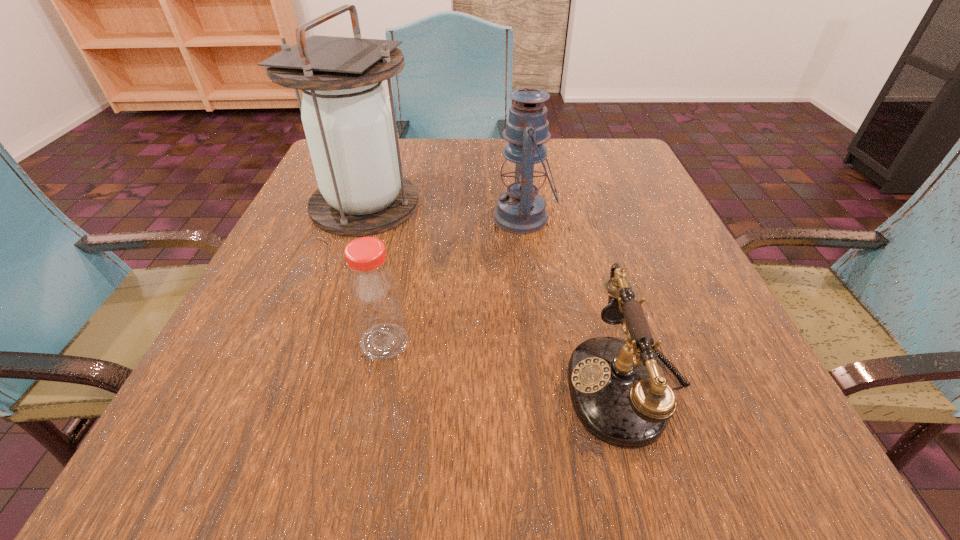
You are a GUI agent. You are given a task and a screenshot of the screen. Output one action in this format:
    pyautogui.click(x=<x>, y=<y>)
    Task: Click on the vacant space located on the front of the third tallest object
    Image resolution: width=960 pixels, height=540 pixels.
    Given the screenshot: What is the action you would take?
    pyautogui.click(x=372, y=407)

Find the location of `free region located on the dial of the shortest object`. free region located on the dial of the shortest object is located at coordinates (371, 383).

The height and width of the screenshot is (540, 960). In order to click on free location located on the dial of the shortest object in this screenshot , I will do `click(514, 383)`.

Where is `free space located on the dial of the shortest object`? free space located on the dial of the shortest object is located at coordinates (439, 383).

Locate an element on the screen. object located in the far edge section of the desktop is located at coordinates (350, 125).

Where is `object present at the near edge`? The height and width of the screenshot is (540, 960). object present at the near edge is located at coordinates (618, 394).

The height and width of the screenshot is (540, 960). Find the location of `object that is at the left edge`. object that is at the left edge is located at coordinates (350, 125).

Where is `object that is at the right edge`? The width and height of the screenshot is (960, 540). object that is at the right edge is located at coordinates (618, 394).

Locate an element on the screen. This screenshot has height=540, width=960. object situated at the far left corner is located at coordinates (350, 125).

Find the location of a particular element. The image size is (960, 540). object present at the near right corner is located at coordinates (618, 394).